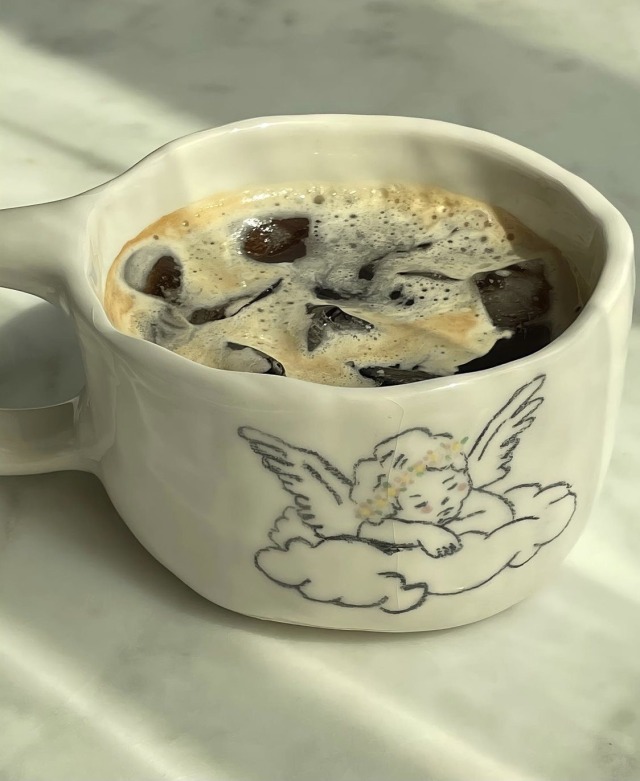
Where is `mug`? This screenshot has height=781, width=640. mug is located at coordinates (218, 497).